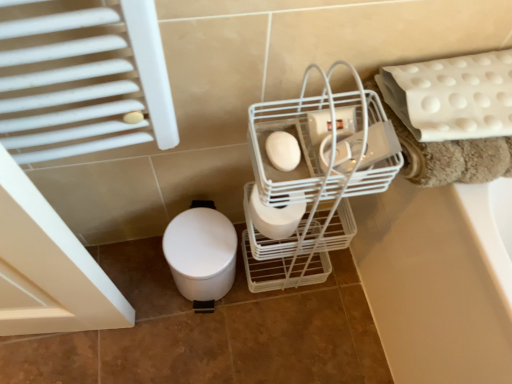
Question: Is white matte toilet paper at center, the 2th toilet paper when ordered from bottom to top, inside or outside of white matte toilet paper at center, which is the first toilet paper in bottom-to-top order?

Choices:
 (A) inside
 (B) outside

Answer: (B)

Question: From the image's perspective, is white matte toilet paper at center, positioned as the 1th toilet paper in front-to-back order, above or below white matte toilet paper at center, the first toilet paper viewed from the back?

Choices:
 (A) below
 (B) above

Answer: (B)

Question: Which object is positioned farthest from the white matte toilet paper at center, which is the first toilet paper in bottom-to-top order?

Choices:
 (A) white matte toilet at lower left
 (B) white wire basket at center
 (C) white matte toilet paper at center, which is the second toilet paper from back to front

Answer: (A)

Question: Estimate the real-world distances between objects in this image. Which object is closer to the white matte toilet paper at center, which is the first toilet paper in bottom-to-top order?

Choices:
 (A) white matte toilet at lower left
 (B) white matte toilet paper at center, positioned as the 1th toilet paper in front-to-back order
 (C) white wire basket at center

Answer: (C)